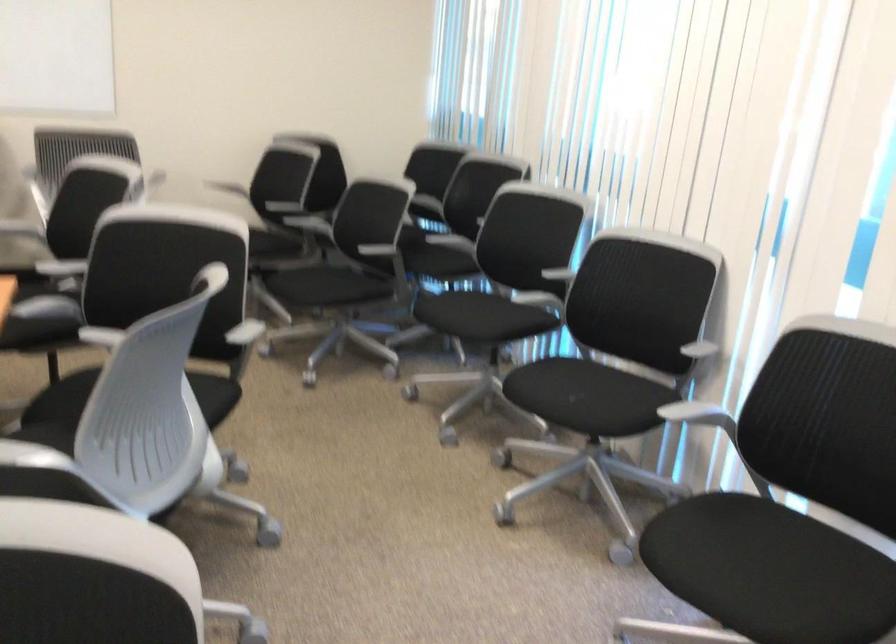
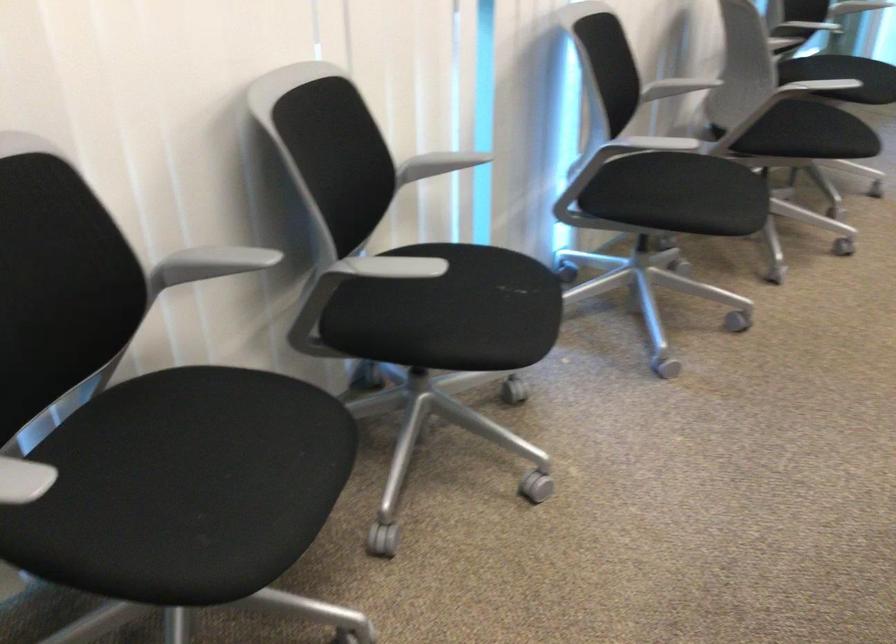
Locate, in the second image, the point that corresponds to point 554,275 in the first image.

(211, 263)